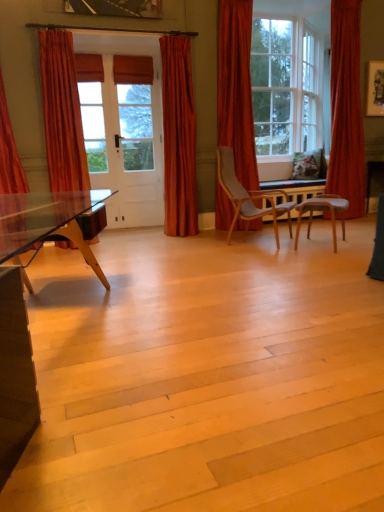
This screenshot has width=384, height=512. What do you see at coordinates (346, 109) in the screenshot?
I see `velvet orange curtain at right, the first curtain from the right` at bounding box center [346, 109].

What do you see at coordinates (248, 196) in the screenshot? Image resolution: width=384 pixels, height=512 pixels. I see `light gray fabric chair at center, which is the first chair in left-to-right order` at bounding box center [248, 196].

Identify the location of clear glass window at upper right. Image resolution: width=384 pixels, height=512 pixels. (286, 86).

Where is `velvet red curtain at right, which appears as the 2th curtain when viewed from the right`? The height and width of the screenshot is (512, 384). velvet red curtain at right, which appears as the 2th curtain when viewed from the right is located at coordinates (236, 88).

Is velvet orange curtain at right, which is counted as the fifth curtain, starting from the left, in front of velvet orange curtain at left, the fourth curtain viewed from the right?

No, velvet orange curtain at right, which is counted as the fifth curtain, starting from the left, is further to the viewer.

Are velvet orange curtain at right, the first curtain from the right, and velvet orange curtain at left, the fourth curtain viewed from the right, far apart?

velvet orange curtain at right, the first curtain from the right, is far away from velvet orange curtain at left, the fourth curtain viewed from the right.

Which of these two, velvet orange curtain at right, the first curtain from the right, or velvet orange curtain at left, the fourth curtain viewed from the right, stands shorter?

velvet orange curtain at left, the fourth curtain viewed from the right.

In the image, is velvet red curtain at right, which appears as the 2th curtain when viewed from the right, positioned in front of or behind light gray fabric chair at center, the second chair when ordered from right to left?

Clearly, velvet red curtain at right, which appears as the 2th curtain when viewed from the right, is behind light gray fabric chair at center, the second chair when ordered from right to left.

How many degrees apart are the facing directions of velvet red curtain at right, the 4th curtain from the left, and light gray fabric chair at center, which is the first chair in left-to-right order?

The angular difference between velvet red curtain at right, the 4th curtain from the left, and light gray fabric chair at center, which is the first chair in left-to-right order, is 42.1 degrees.

Could you tell me if velvet red curtain at right, which appears as the 2th curtain when viewed from the right, is turned towards light gray fabric chair at center, the second chair when ordered from right to left?

Yes, velvet red curtain at right, which appears as the 2th curtain when viewed from the right, faces towards light gray fabric chair at center, the second chair when ordered from right to left.

Is velvet red curtain at right, which appears as the 2th curtain when viewed from the right, thinner than light gray fabric chair at center, which is the first chair in left-to-right order?

Yes, velvet red curtain at right, which appears as the 2th curtain when viewed from the right, is thinner than light gray fabric chair at center, which is the first chair in left-to-right order.

Is matte orange curtain at center, placed as the 3th curtain when sorted from left to right, not close to velvet red curtain at right, the 4th curtain from the left?

matte orange curtain at center, placed as the 3th curtain when sorted from left to right, is near velvet red curtain at right, the 4th curtain from the left, not far away.

Could you tell me if matte orange curtain at center, placed as the 3th curtain when sorted from left to right, is turned towards velvet red curtain at right, which appears as the 2th curtain when viewed from the right?

No, matte orange curtain at center, placed as the 3th curtain when sorted from left to right, does not turn towards velvet red curtain at right, which appears as the 2th curtain when viewed from the right.

Is velvet red curtain at right, the 4th curtain from the left, inside matte orange curtain at center, placed as the 3th curtain when sorted from left to right?

No, velvet red curtain at right, the 4th curtain from the left, is located outside of matte orange curtain at center, placed as the 3th curtain when sorted from left to right.

At what (x,y) coordinates should I click in order to perform the action: click on curtain that is the 1st object located below the velvet orange curtain at right, the first curtain from the right (from the image's perspective). Please return your answer as a coordinate pair (x, y). Looking at the image, I should click on (236, 88).

In the image, is velvet red curtain at right, the 4th curtain from the left, positioned in front of or behind velvet orange curtain at right, the first curtain from the right?

velvet red curtain at right, the 4th curtain from the left, is in front of velvet orange curtain at right, the first curtain from the right.

Does velvet red curtain at right, which appears as the 2th curtain when viewed from the right, have a greater width compared to velvet orange curtain at right, the first curtain from the right?

Correct, the width of velvet red curtain at right, which appears as the 2th curtain when viewed from the right, exceeds that of velvet orange curtain at right, the first curtain from the right.

How many degrees apart are the facing directions of velvet red curtain at right, the 4th curtain from the left, and velvet orange curtain at right, which is counted as the fifth curtain, starting from the left?

There is a 0.894-degree angle between the facing directions of velvet red curtain at right, the 4th curtain from the left, and velvet orange curtain at right, which is counted as the fifth curtain, starting from the left.

Between light gray fabric chair at center right, which is the 1th chair in right-to-left order, and velvet red curtain at right, the 4th curtain from the left, which one has more height?

velvet red curtain at right, the 4th curtain from the left.

Is light gray fabric chair at center right, which is the 2th chair from left to right, facing away from velvet red curtain at right, the 4th curtain from the left?

No.

Considering the relative sizes of light gray fabric chair at center right, which is the 1th chair in right-to-left order, and velvet red curtain at right, the 4th curtain from the left, in the image provided, is light gray fabric chair at center right, which is the 1th chair in right-to-left order, bigger than velvet red curtain at right, the 4th curtain from the left,?

No.

Which object is thinner, light gray fabric chair at center right, which is the 2th chair from left to right, or velvet red curtain at right, which appears as the 2th curtain when viewed from the right?

Thinner between the two is velvet red curtain at right, which appears as the 2th curtain when viewed from the right.

Between velvet red curtain at left, placed as the first curtain when sorted from left to right, and light gray fabric chair at center right, which is the 1th chair in right-to-left order, which one has smaller width?

Thinner between the two is velvet red curtain at left, placed as the first curtain when sorted from left to right.

From the image's perspective, is velvet red curtain at left, placed as the first curtain when sorted from left to right, located above or below light gray fabric chair at center right, which is the 2th chair from left to right?

Based on their image positions, velvet red curtain at left, placed as the first curtain when sorted from left to right, is located above light gray fabric chair at center right, which is the 2th chair from left to right.

Is velvet red curtain at left, placed as the first curtain when sorted from left to right, turned away from light gray fabric chair at center right, which is the 1th chair in right-to-left order?

No, velvet red curtain at left, placed as the first curtain when sorted from left to right, is not facing away from light gray fabric chair at center right, which is the 1th chair in right-to-left order.

Who is taller, velvet red curtain at left, the 5th curtain when ordered from right to left, or light gray fabric chair at center right, which is the 2th chair from left to right?

velvet red curtain at left, the 5th curtain when ordered from right to left, is taller.

Based on the photo, which of these two, velvet orange curtain at left, the fourth curtain viewed from the right, or velvet red curtain at left, the 5th curtain when ordered from right to left, is smaller?

velvet red curtain at left, the 5th curtain when ordered from right to left.

Consider the image. Is velvet orange curtain at left, the fourth curtain viewed from the right, positioned far away from velvet red curtain at left, placed as the first curtain when sorted from left to right?

velvet orange curtain at left, the fourth curtain viewed from the right, is actually quite close to velvet red curtain at left, placed as the first curtain when sorted from left to right.

Is velvet orange curtain at left, the fourth curtain viewed from the right, wider or thinner than velvet red curtain at left, placed as the first curtain when sorted from left to right?

In the image, velvet orange curtain at left, the fourth curtain viewed from the right, appears to be more narrow than velvet red curtain at left, placed as the first curtain when sorted from left to right.

How many degrees apart are the facing directions of velvet orange curtain at left, which appears as the second curtain when viewed from the left, and velvet red curtain at left, placed as the first curtain when sorted from left to right?

They differ by 1.2 degrees in their facing directions.

Starting from the velvet orange curtain at left, the fourth curtain viewed from the right, which curtain is the 3rd one to the right? Please provide its 2D coordinates.

[(346, 109)]

From a real-world perspective, count 1st chairs downward from the velvet red curtain at right, the 4th curtain from the left, and point to it. Please provide its 2D coordinates.

[(248, 196)]

Looking at the image, which one is located further to clear glass window at upper right, velvet red curtain at left, the 5th curtain when ordered from right to left, or matte orange curtain at center, the 3th curtain in the right-to-left sequence?

velvet red curtain at left, the 5th curtain when ordered from right to left.

Looking at this image, from the image, which object appears to be nearer to velvet orange curtain at left, which appears as the second curtain when viewed from the left, light gray fabric chair at center, the second chair when ordered from right to left, or velvet red curtain at right, the 4th curtain from the left?

Based on the image, velvet red curtain at right, the 4th curtain from the left, appears to be nearer to velvet orange curtain at left, which appears as the second curtain when viewed from the left.

Based on their spatial positions, is velvet red curtain at left, placed as the first curtain when sorted from left to right, or velvet red curtain at right, which appears as the 2th curtain when viewed from the right, further from velvet orange curtain at left, which appears as the second curtain when viewed from the left?

Among the two, velvet red curtain at right, which appears as the 2th curtain when viewed from the right, is located further to velvet orange curtain at left, which appears as the second curtain when viewed from the left.

When comparing their distances from clear glass window at upper right, does velvet red curtain at left, placed as the first curtain when sorted from left to right, or light gray fabric chair at center, the second chair when ordered from right to left, seem further?

Based on the image, velvet red curtain at left, placed as the first curtain when sorted from left to right, appears to be further to clear glass window at upper right.

Looking at the image, which one is located closer to velvet red curtain at right, the 4th curtain from the left, light gray fabric chair at center right, which is the 1th chair in right-to-left order, or light gray fabric chair at center, which is the first chair in left-to-right order?

light gray fabric chair at center, which is the first chair in left-to-right order, lies closer to velvet red curtain at right, the 4th curtain from the left, than the other object.

Considering their positions, is velvet red curtain at right, which appears as the 2th curtain when viewed from the right, positioned closer to velvet red curtain at left, placed as the first curtain when sorted from left to right, than light gray fabric chair at center right, which is the 2th chair from left to right?

velvet red curtain at right, which appears as the 2th curtain when viewed from the right, is closer to velvet red curtain at left, placed as the first curtain when sorted from left to right.

Looking at the image, which one is located further to velvet red curtain at left, the 5th curtain when ordered from right to left, matte orange curtain at center, placed as the 3th curtain when sorted from left to right, or clear glass window at upper right?

Based on the image, clear glass window at upper right appears to be further to velvet red curtain at left, the 5th curtain when ordered from right to left.

From the image, which object appears to be farther from velvet red curtain at right, which appears as the 2th curtain when viewed from the right, light gray fabric chair at center right, which is the 1th chair in right-to-left order, or clear glass window at upper right?

light gray fabric chair at center right, which is the 1th chair in right-to-left order, is further to velvet red curtain at right, which appears as the 2th curtain when viewed from the right.

This screenshot has width=384, height=512. I want to click on chair between velvet red curtain at right, the 4th curtain from the left, and light gray fabric chair at center right, which is the 1th chair in right-to-left order, in the up-down direction, so click(x=248, y=196).

Find the location of `curtain situated between matte orange curtain at center, placed as the 3th curtain when sorted from left to right, and clear glass window at upper right from left to right`. curtain situated between matte orange curtain at center, placed as the 3th curtain when sorted from left to right, and clear glass window at upper right from left to right is located at coordinates (236, 88).

Locate an element on the screen. Image resolution: width=384 pixels, height=512 pixels. chair located between velvet red curtain at left, the 5th curtain when ordered from right to left, and clear glass window at upper right in the left-right direction is located at coordinates (248, 196).

Locate an element on the screen. window located between velvet red curtain at left, placed as the first curtain when sorted from left to right, and light gray fabric chair at center right, which is the 1th chair in right-to-left order, in the left-right direction is located at coordinates (286, 86).